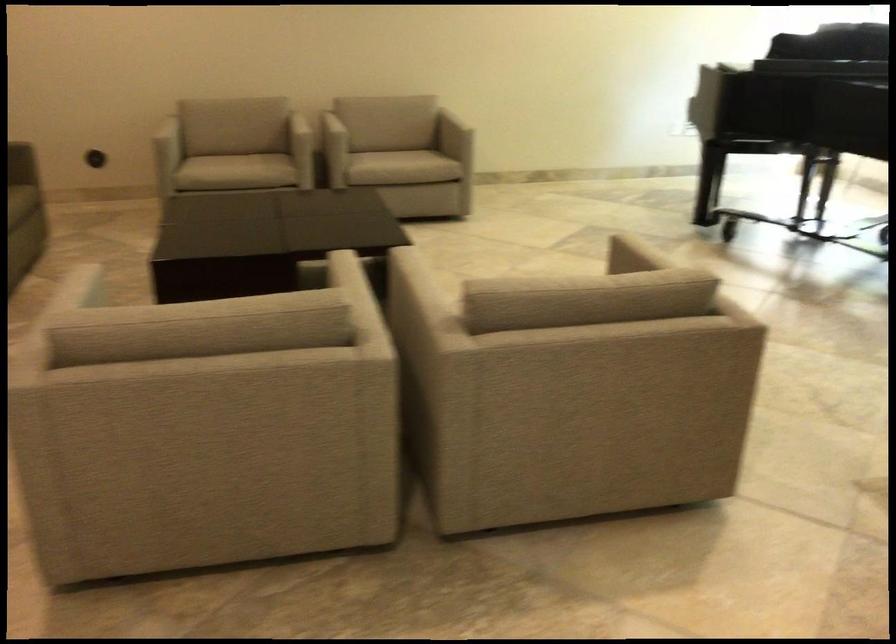
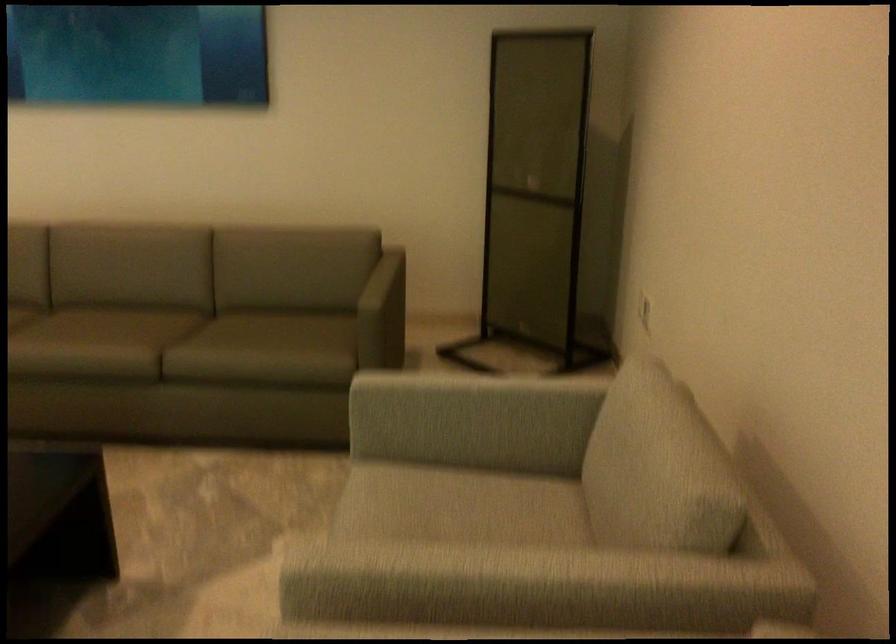
In the second image, find the point that corresponds to the point at 194,158 in the first image.

(455, 491)